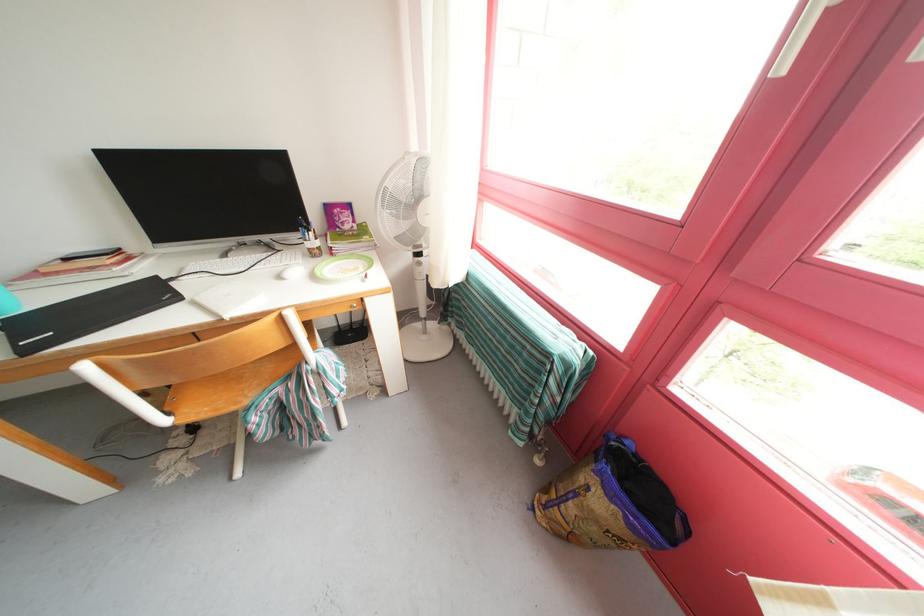
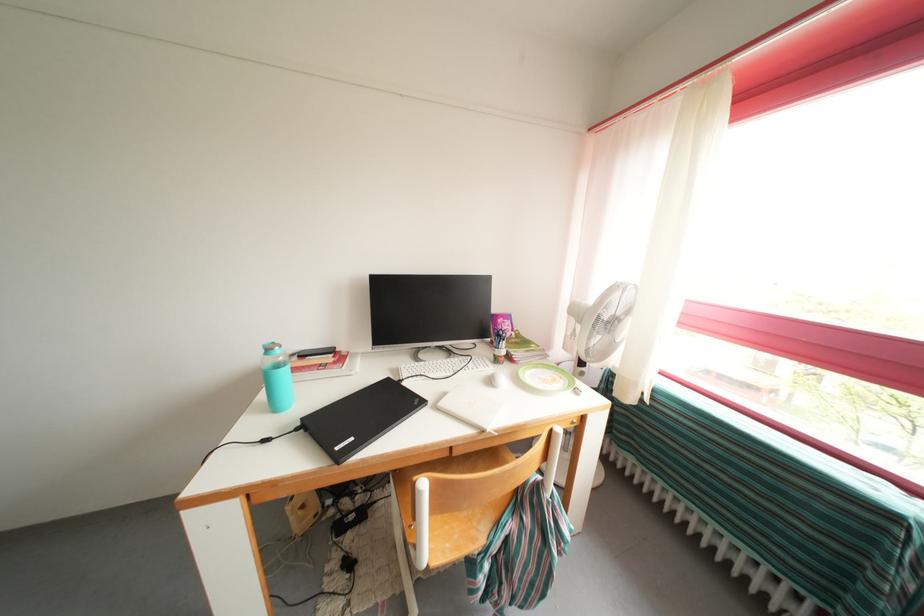
Question: In a continuous first-person perspective shot, in which direction is the camera moving?

Choices:
 (A) Left
 (B) Right
 (C) Forward
 (D) Backward

Answer: (A)